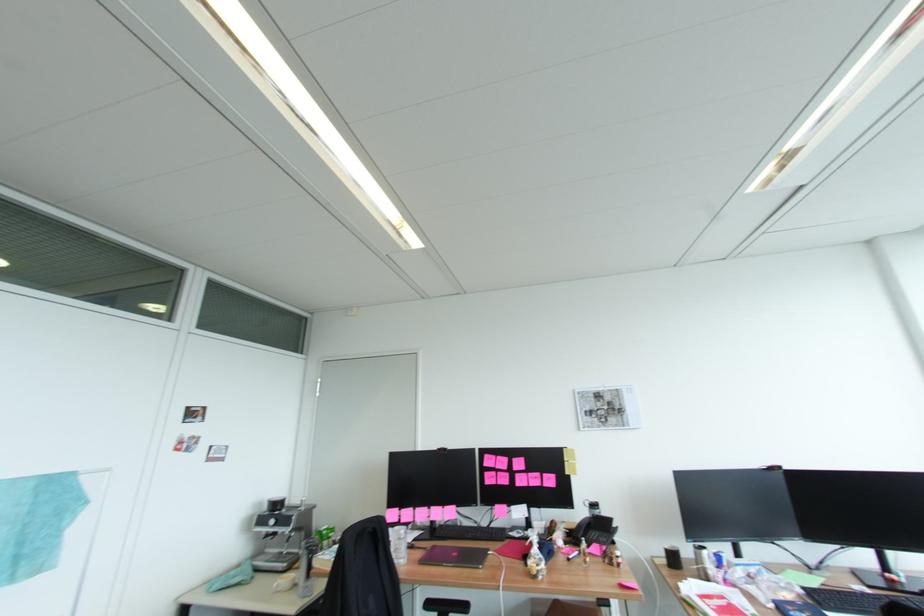
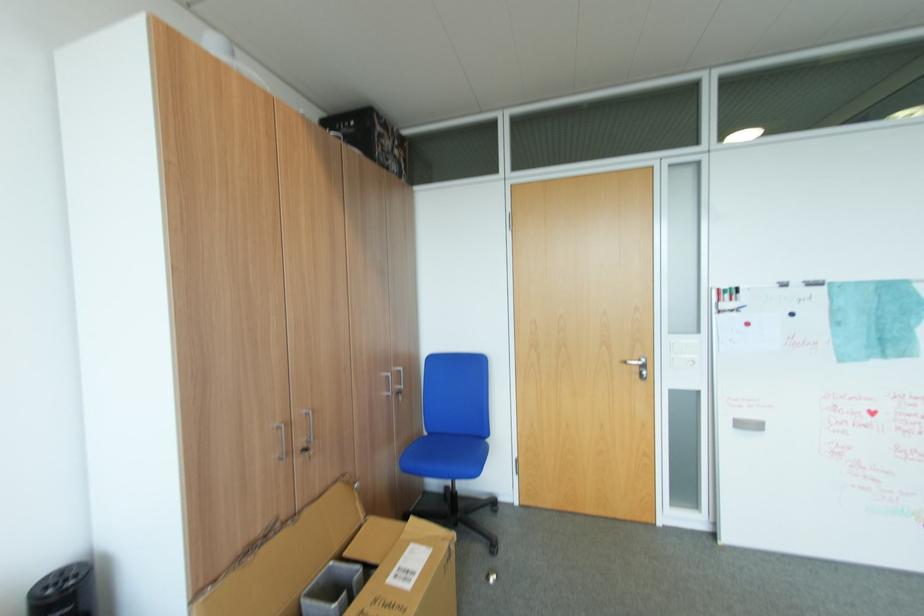
Question: Based on the continuous images, in which direction is the camera rotating? Reply with the corresponding letter.

Choices:
 (A) Left
 (B) Right
 (C) Up
 (D) Down

Answer: (A)